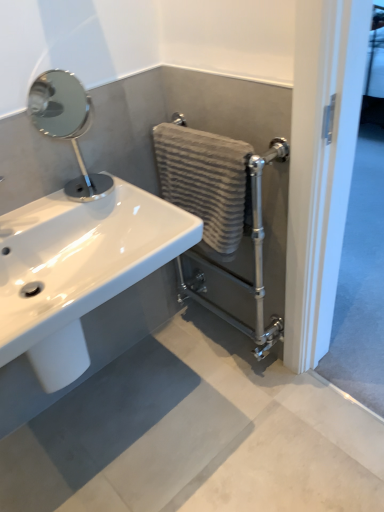
Question: Does textured beige towel at center-right turn towards polished chrome mirror at upper left?

Choices:
 (A) yes
 (B) no

Answer: (A)

Question: Could polished chrome mirror at upper left be considered to be inside textured beige towel at center-right?

Choices:
 (A) no
 (B) yes

Answer: (A)

Question: From a real-world perspective, is textured beige towel at center-right beneath polished chrome mirror at upper left?

Choices:
 (A) no
 (B) yes

Answer: (B)

Question: From the image's perspective, is textured beige towel at center-right on top of polished chrome mirror at upper left?

Choices:
 (A) yes
 (B) no

Answer: (B)

Question: Can you confirm if textured beige towel at center-right is bigger than polished chrome mirror at upper left?

Choices:
 (A) yes
 (B) no

Answer: (A)

Question: Is textured beige towel at center-right at the right side of polished chrome mirror at upper left?

Choices:
 (A) no
 (B) yes

Answer: (B)

Question: Is polished chrome mirror at upper left surrounded by matte gray concrete at lower center?

Choices:
 (A) yes
 (B) no

Answer: (B)

Question: Is matte gray concrete at lower center smaller than polished chrome mirror at upper left?

Choices:
 (A) yes
 (B) no

Answer: (B)

Question: Is matte gray concrete at lower center shorter than polished chrome mirror at upper left?

Choices:
 (A) yes
 (B) no

Answer: (A)

Question: Considering the relative positions of matte gray concrete at lower center and polished chrome mirror at upper left in the image provided, is matte gray concrete at lower center to the left of polished chrome mirror at upper left from the viewer's perspective?

Choices:
 (A) no
 (B) yes

Answer: (A)

Question: Is matte gray concrete at lower center taller than polished chrome mirror at upper left?

Choices:
 (A) no
 (B) yes

Answer: (A)

Question: From the image's perspective, is matte gray concrete at lower center below polished chrome mirror at upper left?

Choices:
 (A) yes
 (B) no

Answer: (A)

Question: Does matte gray concrete at lower center have a smaller size compared to textured beige towel at center-right?

Choices:
 (A) yes
 (B) no

Answer: (B)